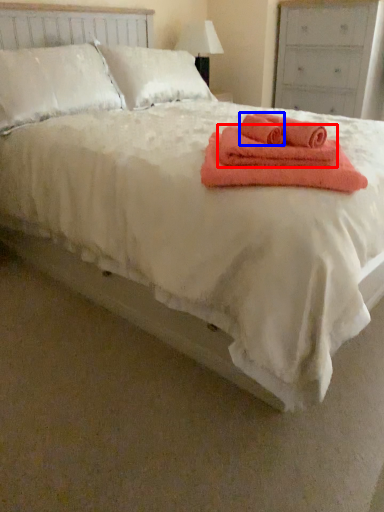
Question: Which point is closer to the camera, bath towel (highlighted by a red box) or bath towel (highlighted by a blue box)?

Choices:
 (A) bath towel
 (B) bath towel

Answer: (A)